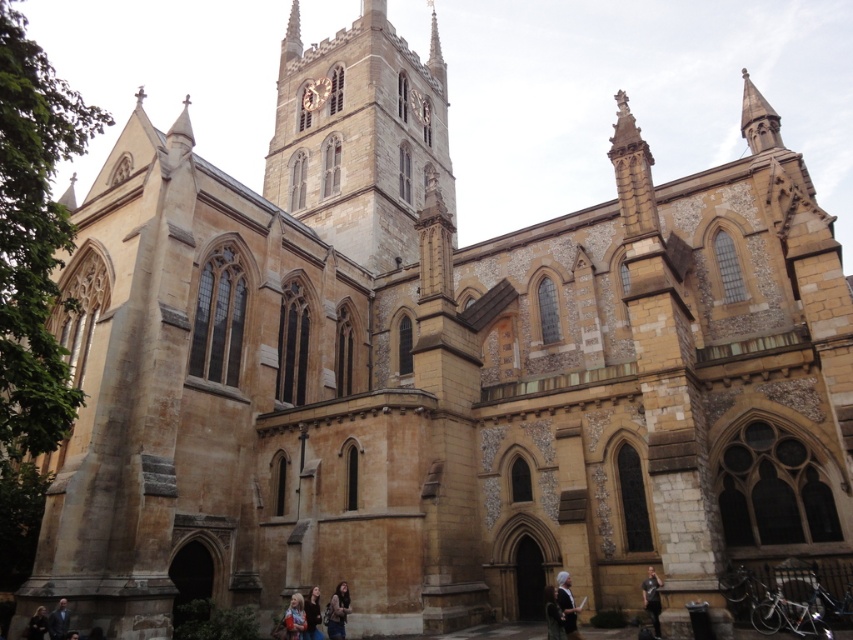
Question: Does matte brown jacket at lower center appear under dark brown leather jacket at lower left?

Choices:
 (A) yes
 (B) no

Answer: (A)

Question: Can you confirm if dark brown leather jacket at lower right is wider than gold metallic clock at center?

Choices:
 (A) yes
 (B) no

Answer: (B)

Question: Which is nearer to the dark brown leather jacket at lower left?

Choices:
 (A) dark brown leather jacket at lower right
 (B) light brown leather jacket at lower center
 (C) dark gray suit at lower left

Answer: (C)

Question: Which object is closer to the camera taking this photo?

Choices:
 (A) matte brown hair at lower center
 (B) golden stone tower at center
 (C) dark brown leather jacket at lower left

Answer: (C)

Question: Estimate the real-world distances between objects in this image. Which object is closer to the golden stone tower at center?

Choices:
 (A) dark blue shirt at lower center
 (B) matte brown hair at lower center

Answer: (A)

Question: Does golden stone tower at center appear over dark gray suit at lower left?

Choices:
 (A) yes
 (B) no

Answer: (A)